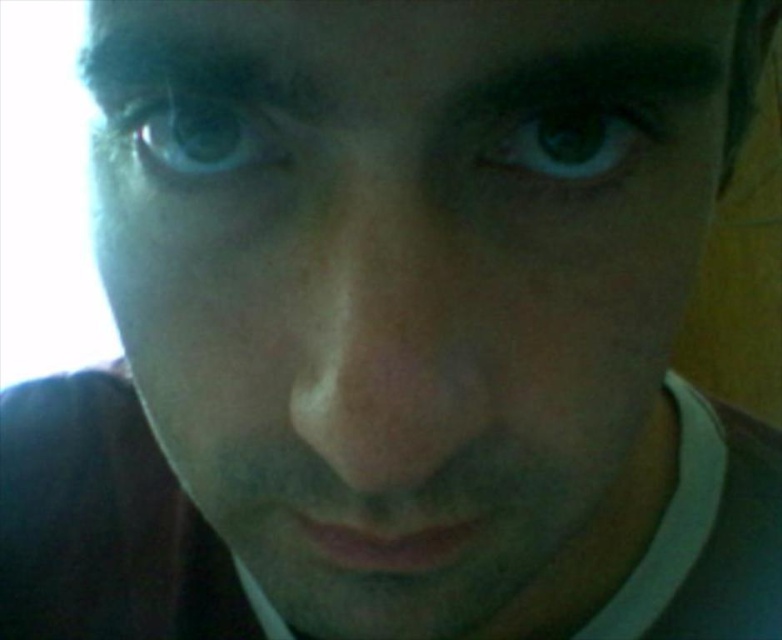
Between brown matte eye at center and blue iridescent eye at upper left, which one appears on the left side from the viewer's perspective?

From the viewer's perspective, blue iridescent eye at upper left appears more on the left side.

Measure the distance between point (540, 145) and camera.

Point (540, 145) is 8.72 inches from camera.

Where is `brown matte eye at center`? This screenshot has width=782, height=640. brown matte eye at center is located at coordinates (567, 140).

The height and width of the screenshot is (640, 782). I want to click on brown matte eye at center, so (567, 140).